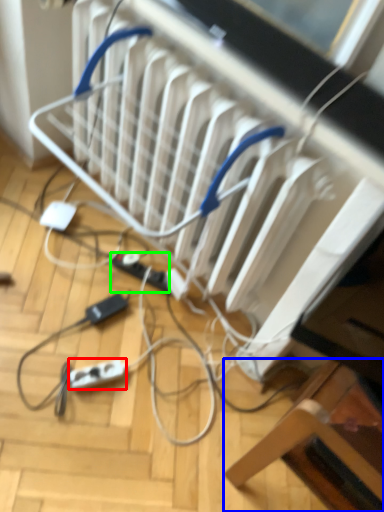
Question: Estimate the real-world distances between objects in this image. Which object is farther from extension cord (highlighted by a red box), furniture (highlighted by a blue box) or extension cord (highlighted by a green box)?

Choices:
 (A) furniture
 (B) extension cord

Answer: (A)